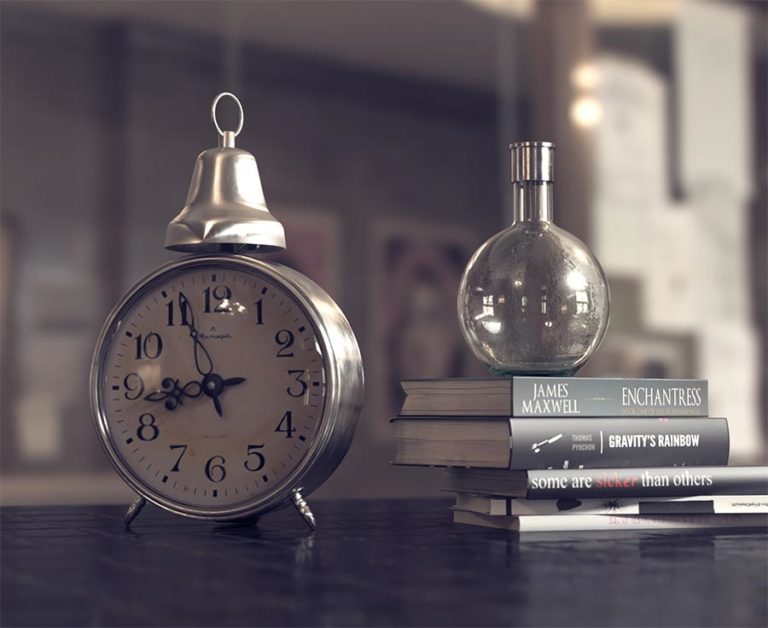
You are a GUI agent. You are given a task and a screenshot of the screen. Output one action in this format:
    pyautogui.click(x=<x>, y=<y>)
    Task: Click on the white clock face
    The width and height of the screenshot is (768, 628).
    Given the screenshot: What is the action you would take?
    pyautogui.click(x=234, y=352)